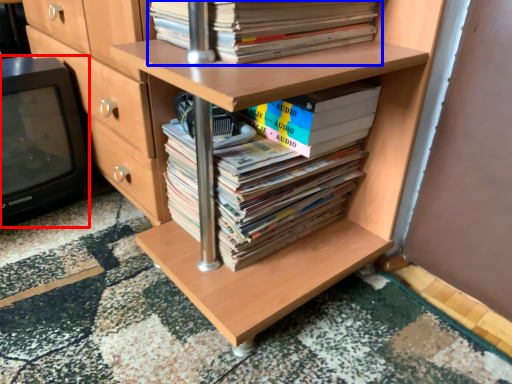
Question: Which of the following is the farthest to the observer, wide (highlighted by a red box) or book (highlighted by a blue box)?

Choices:
 (A) wide
 (B) book

Answer: (A)